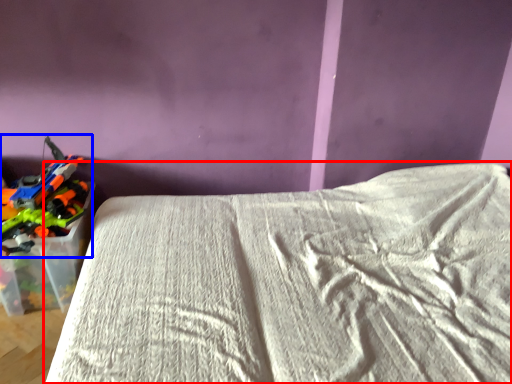
Question: Which object is closer to the camera taking this photo, bed (highlighted by a red box) or toy (highlighted by a blue box)?

Choices:
 (A) bed
 (B) toy

Answer: (A)